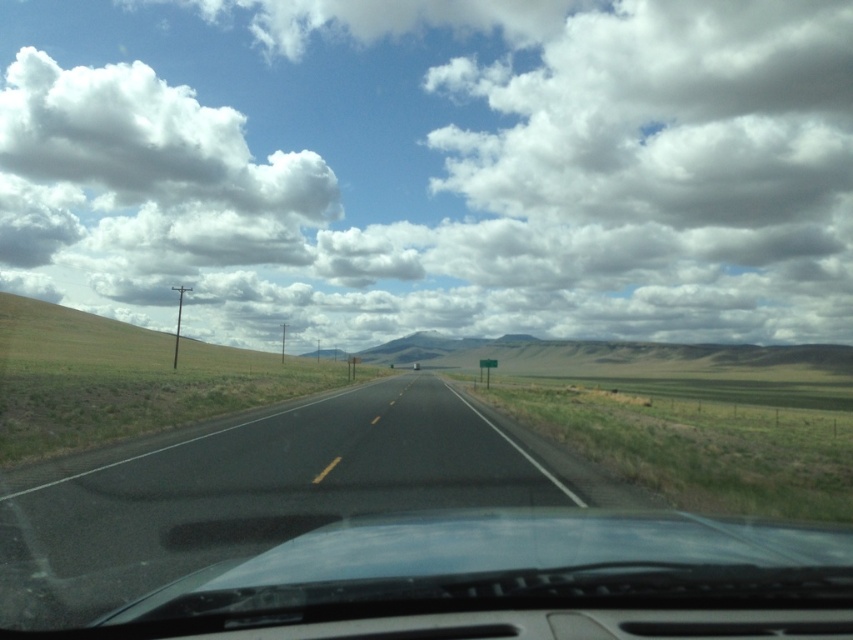
Can you confirm if white fluffy cloud at upper center is wider than black asphalt highway at center?

Yes.

Can you confirm if white fluffy cloud at upper center is positioned to the right of black asphalt highway at center?

No, white fluffy cloud at upper center is not to the right of black asphalt highway at center.

What do you see at coordinates (432, 166) in the screenshot? I see `white fluffy cloud at upper center` at bounding box center [432, 166].

Image resolution: width=853 pixels, height=640 pixels. Find the location of `white fluffy cloud at upper center`. white fluffy cloud at upper center is located at coordinates (432, 166).

Image resolution: width=853 pixels, height=640 pixels. I want to click on black asphalt highway at center, so click(248, 492).

Between point (113, 502) and point (337, 534), which one is positioned in front?

Point (337, 534)

Image resolution: width=853 pixels, height=640 pixels. I want to click on black asphalt highway at center, so click(248, 492).

In the scene shown: Does white fluffy cloud at upper center appear on the left side of transparent glass windshield at center?

Correct, you'll find white fluffy cloud at upper center to the left of transparent glass windshield at center.

The image size is (853, 640). Describe the element at coordinates (432, 166) in the screenshot. I see `white fluffy cloud at upper center` at that location.

What do you see at coordinates (432, 166) in the screenshot? The image size is (853, 640). I see `white fluffy cloud at upper center` at bounding box center [432, 166].

Where is `white fluffy cloud at upper center`? Image resolution: width=853 pixels, height=640 pixels. white fluffy cloud at upper center is located at coordinates (432, 166).